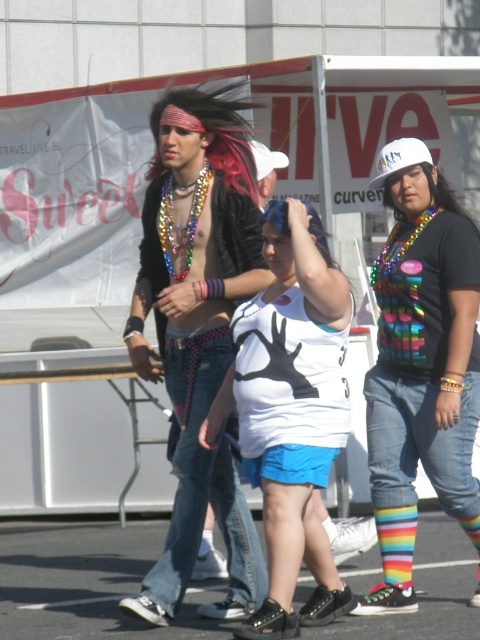
You are standing at the entrance of the event and want to find the rainbow striped socks at center. According to the coordinates provided, in which direction should you look relative to your current position?

The rainbow striped socks at center is located at point 0.570 on the x axis and 0.877 on the y axis. Since the coordinates are relative to the image, you should look towards the center of the image slightly to the right and upwards from your position at the entrance.

You are a photographer at the event and want to capture both the rainbow striped socks at center and the white matte baseball cap at upper center in the same frame. Which object should you focus on first to ensure both are in the frame?

The rainbow striped socks at center is much taller than the white matte baseball cap at upper center, so you should focus on the rainbow striped socks at center first to ensure both are in the frame.

You are standing at the origin point in the image and looking towards the banner. Which of the two points, point (263, 243) or point (398, 150), is closer to you?

Point (398, 150) is closer to you because it is in front of point (263, 243).